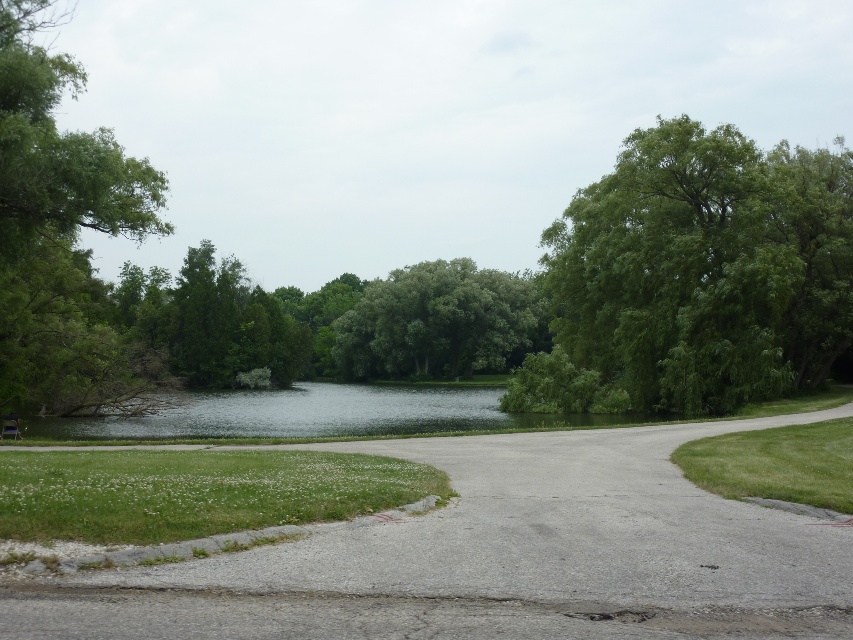
Is green leafy tree at left positioned behind green grass at lower left?

Yes, it is.

This screenshot has height=640, width=853. I want to click on green leafy tree at left, so click(x=59, y=228).

Is point (50, 84) positioned after point (407, 499)?

Yes, point (50, 84) is farther from viewer.

This screenshot has width=853, height=640. I want to click on green leafy tree at left, so click(59, 228).

Is green leafy tree at upper right to the left of green leafy tree at center from the viewer's perspective?

In fact, green leafy tree at upper right is to the right of green leafy tree at center.

Does green leafy tree at upper right have a lesser width compared to green leafy tree at center?

Incorrect, green leafy tree at upper right's width is not less than green leafy tree at center's.

Does point (660, 285) come farther from viewer compared to point (357, 360)?

No, (660, 285) is closer to viewer.

This screenshot has height=640, width=853. Find the location of `green leafy tree at upper right`. green leafy tree at upper right is located at coordinates (700, 273).

Which is above, gray asphalt driveway at center or green leafy tree at center?

green leafy tree at center is higher up.

Who is more distant from viewer, (693, 589) or (407, 364)?

The point (407, 364) is more distant.

Between point (415, 440) and point (469, 332), which one is positioned in front?

Point (415, 440)

Identify the location of gray asphalt driveway at center. The height and width of the screenshot is (640, 853). (495, 556).